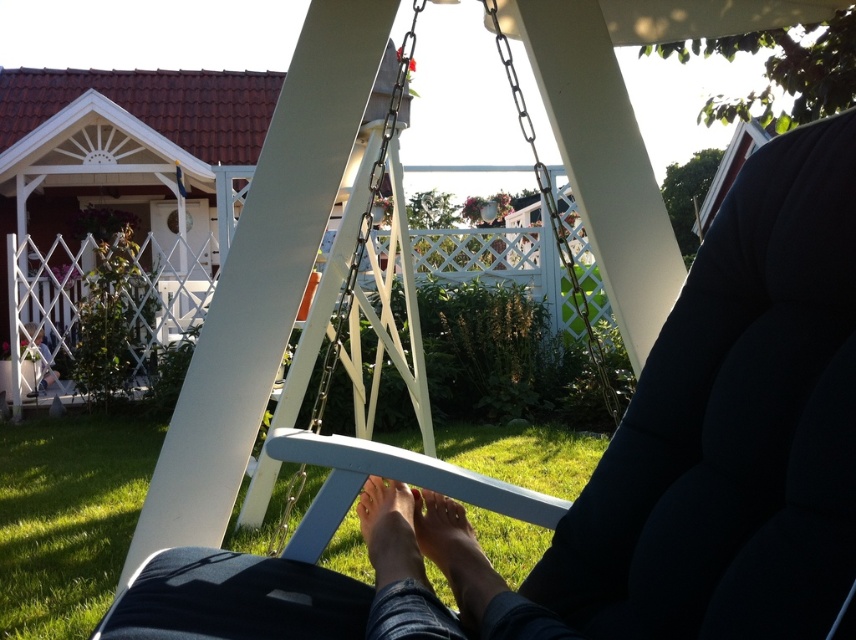
Question: Which object is farther from the camera taking this photo?

Choices:
 (A) white matte swing at center
 (B) matte black cushion at center
 (C) white painted wood swing at center

Answer: (C)

Question: Is matte black cushion at center below white matte swing at center?

Choices:
 (A) no
 (B) yes

Answer: (B)

Question: Can you confirm if white painted wood swing at center is positioned above white matte swing at center?

Choices:
 (A) yes
 (B) no

Answer: (B)

Question: Is matte black cushion at center in front of white painted wood swing at center?

Choices:
 (A) yes
 (B) no

Answer: (A)

Question: Among these points, which one is farthest from the camera?

Choices:
 (A) (33, 392)
 (B) (401, 486)
 (C) (462, 612)
 (D) (383, 125)

Answer: (A)

Question: Which object is positioned closest to the matte black cushion at center?

Choices:
 (A) brown matte skin at lower center
 (B) smooth skin foot at center

Answer: (A)